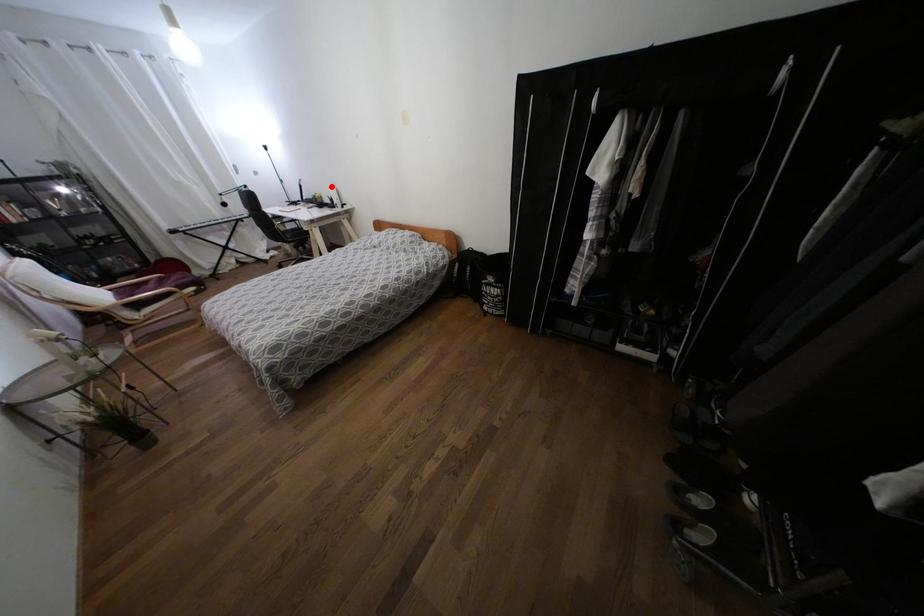
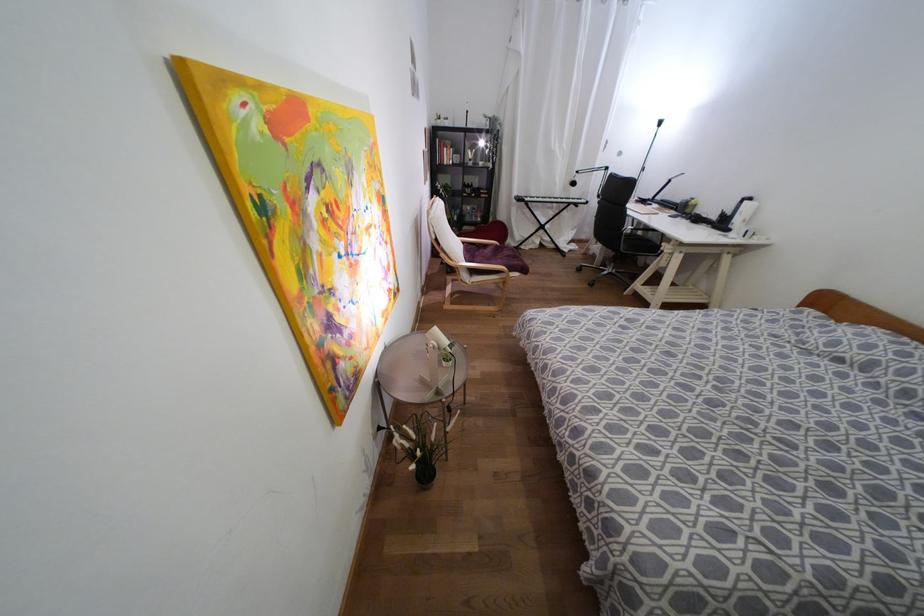
Question: I am providing you with two images of the same scene from different viewpoints. A red point is shown in image1. For the corresponding object point in image2, is it positioned nearer or farther from the camera?

Choices:
 (A) Nearer
 (B) Farther

Answer: (B)